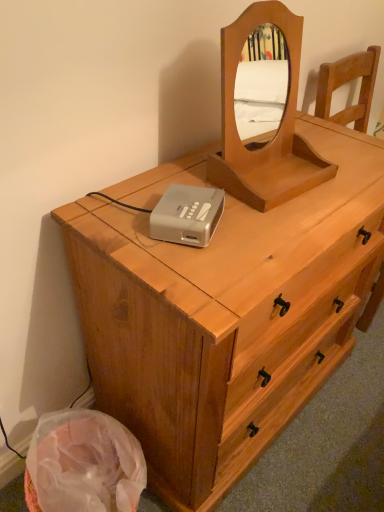
Question: Considering the relative sizes of silver plastic cassette at center and light brown wooden mirror at upper center in the image provided, is silver plastic cassette at center wider than light brown wooden mirror at upper center?

Choices:
 (A) no
 (B) yes

Answer: (A)

Question: Is the depth of silver plastic cassette at center less than that of light brown wooden mirror at upper center?

Choices:
 (A) no
 (B) yes

Answer: (A)

Question: Can you confirm if silver plastic cassette at center is shorter than light brown wooden mirror at upper center?

Choices:
 (A) yes
 (B) no

Answer: (A)

Question: Are silver plastic cassette at center and light brown wooden mirror at upper center making contact?

Choices:
 (A) no
 (B) yes

Answer: (A)

Question: Is silver plastic cassette at center to the left of light brown wooden mirror at upper center from the viewer's perspective?

Choices:
 (A) yes
 (B) no

Answer: (A)

Question: In terms of width, does silver plastic cassette at center look wider or thinner when compared to light brown wooden mirror at upper center?

Choices:
 (A) thin
 (B) wide

Answer: (A)

Question: From the image's perspective, is silver plastic cassette at center located above or below light brown wooden mirror at upper center?

Choices:
 (A) below
 (B) above

Answer: (A)

Question: Considering the positions of silver plastic cassette at center and light brown wooden mirror at upper center in the image, is silver plastic cassette at center taller or shorter than light brown wooden mirror at upper center?

Choices:
 (A) short
 (B) tall

Answer: (A)

Question: Is silver plastic cassette at center situated inside light brown wooden mirror at upper center or outside?

Choices:
 (A) outside
 (B) inside

Answer: (A)

Question: Based on their sizes in the image, would you say silver plastic cassette at center is bigger or smaller than light brown wood chest of drawers at center?

Choices:
 (A) big
 (B) small

Answer: (B)

Question: From the image's perspective, relative to light brown wood chest of drawers at center, is silver plastic cassette at center above or below?

Choices:
 (A) above
 (B) below

Answer: (A)

Question: Is silver plastic cassette at center taller or shorter than light brown wood chest of drawers at center?

Choices:
 (A) tall
 (B) short

Answer: (B)

Question: Considering the positions of point pyautogui.click(x=210, y=195) and point pyautogui.click(x=360, y=225), is point pyautogui.click(x=210, y=195) closer or farther from the camera than point pyautogui.click(x=360, y=225)?

Choices:
 (A) closer
 (B) farther

Answer: (A)

Question: In the image, is light brown wood chest of drawers at center positioned in front of or behind light brown wooden mirror at upper center?

Choices:
 (A) front
 (B) behind

Answer: (A)

Question: From a real-world perspective, is light brown wood chest of drawers at center physically located above or below light brown wooden mirror at upper center?

Choices:
 (A) above
 (B) below

Answer: (B)